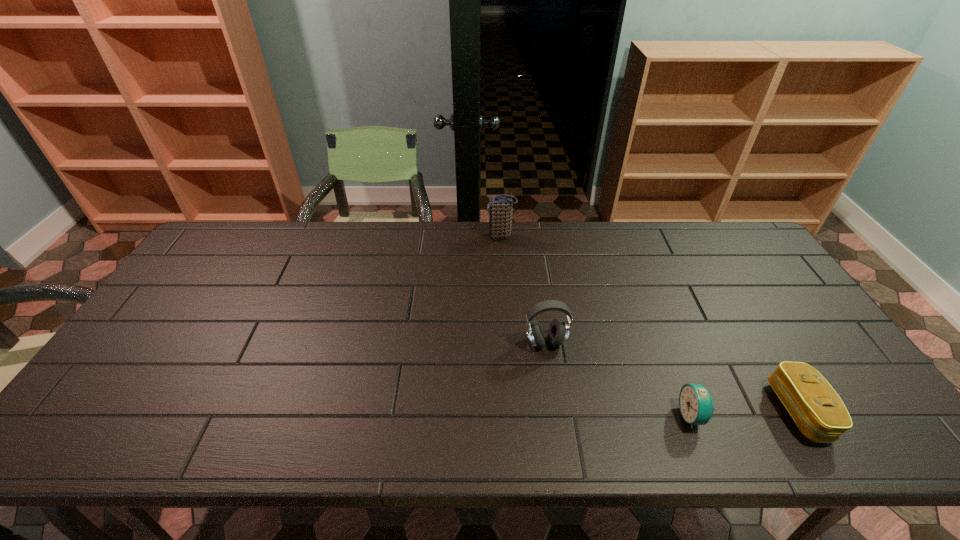
Find the location of `object present at the near right corner`. object present at the near right corner is located at coordinates (818, 411).

You are a GUI agent. You are given a task and a screenshot of the screen. Output one action in this format:
    pyautogui.click(x=<x>, y=<y>)
    Task: Click on the vacant space at the far edge of the desktop
    Image resolution: width=960 pixels, height=540 pixels.
    Given the screenshot: What is the action you would take?
    pyautogui.click(x=447, y=231)

The height and width of the screenshot is (540, 960). Find the location of `free region at the near edge of the desktop`. free region at the near edge of the desktop is located at coordinates (367, 441).

This screenshot has width=960, height=540. Find the location of `vacant position at the left edge of the desktop`. vacant position at the left edge of the desktop is located at coordinates (197, 309).

Image resolution: width=960 pixels, height=540 pixels. Identify the location of free space at the right edge of the desktop. (809, 349).

Locate an element on the screen. The width and height of the screenshot is (960, 540). free region at the near left corner of the desktop is located at coordinates (132, 436).

Identify the location of free spot at the far right corner of the desktop. (709, 228).

This screenshot has height=540, width=960. Find the location of `free spot between the rightmost object and the farther clutch bag`. free spot between the rightmost object and the farther clutch bag is located at coordinates (650, 323).

Locate an element on the screen. vacant space that's between the shorter clutch bag and the farthest object is located at coordinates (650, 323).

Locate an element on the screen. This screenshot has height=540, width=960. free space between the shorter clutch bag and the second object from right to left is located at coordinates (746, 413).